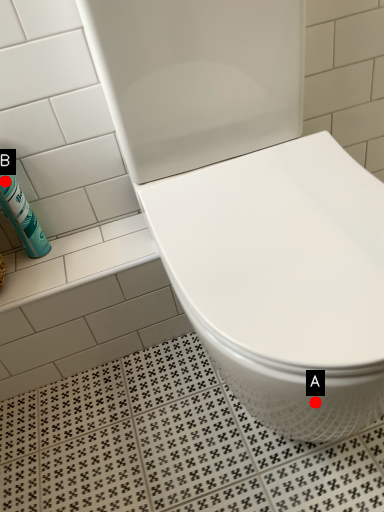
Question: Two points are circled on the image, labeled by A and B beside each circle. Which point appears closest to the camera in this image?

Choices:
 (A) A is closer
 (B) B is closer

Answer: (A)